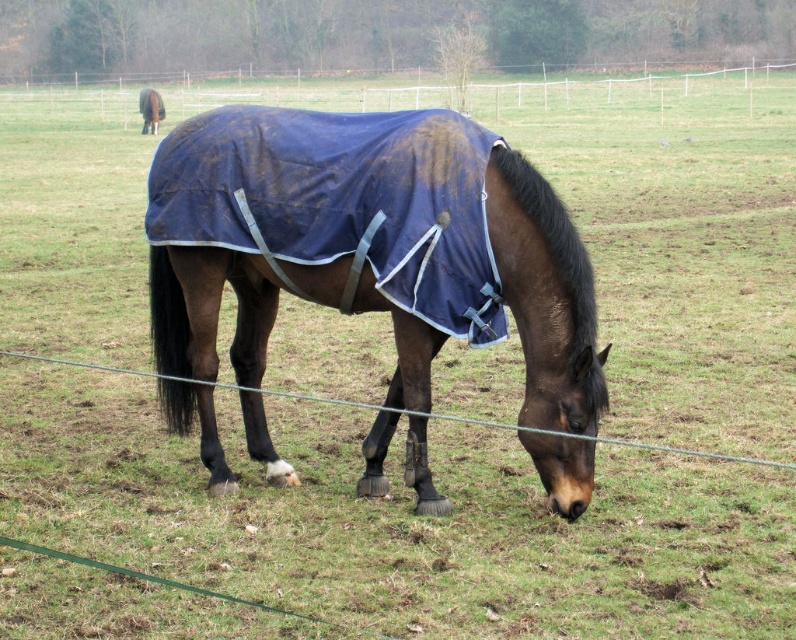
Can you confirm if dull blue fabric at center is positioned below brown glossy horse at upper left?

Correct, dull blue fabric at center is located below brown glossy horse at upper left.

Between dull blue fabric at center and brown glossy horse at upper left, which one has less height?

Standing shorter between the two is brown glossy horse at upper left.

The height and width of the screenshot is (640, 796). I want to click on dull blue fabric at center, so click(x=369, y=246).

Does dull blue fabric at center have a lesser height compared to white plastic fence at upper center?

Indeed, dull blue fabric at center has a lesser height compared to white plastic fence at upper center.

Is dull blue fabric at center to the right of white plastic fence at upper center from the viewer's perspective?

Yes, dull blue fabric at center is to the right of white plastic fence at upper center.

Which is in front, point (568, 406) or point (615, 84)?

Point (568, 406)

At what (x,y) coordinates should I click in order to perform the action: click on dull blue fabric at center. Please return your answer as a coordinate pair (x, y). Image resolution: width=796 pixels, height=640 pixels. Looking at the image, I should click on (369, 246).

Does blue fabric blanket at center appear under white plastic fence at upper center?

Indeed, blue fabric blanket at center is positioned under white plastic fence at upper center.

Who is higher up, blue fabric blanket at center or white plastic fence at upper center?

white plastic fence at upper center

Which is in front, point (379, 145) or point (10, 93)?

Point (379, 145) is in front.

You are a GUI agent. You are given a task and a screenshot of the screen. Output one action in this format:
    pyautogui.click(x=<x>, y=<y>)
    Task: Click on the blue fabric blanket at center
    This screenshot has height=640, width=796.
    Given the screenshot: What is the action you would take?
    coord(341,202)